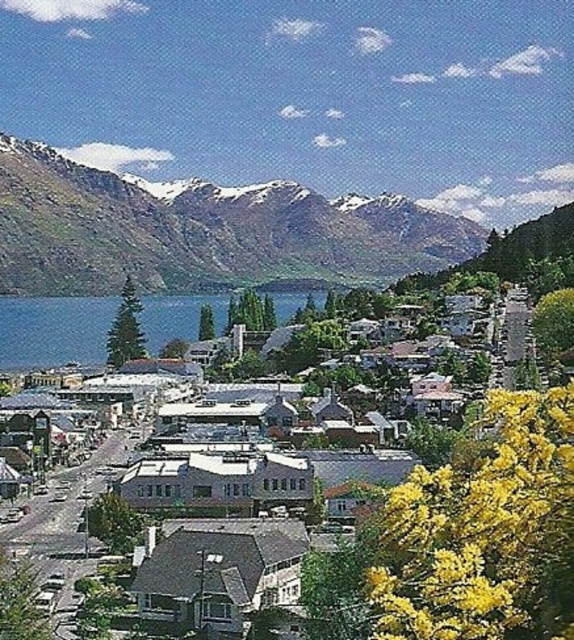
Between snowy rocky mountain at upper left and white matte building at center, which one has less height?

With less height is white matte building at center.

Does point (296, 244) come farther from viewer compared to point (60, 349)?

Yes, it is.

This screenshot has height=640, width=574. Find the location of `snowy rocky mountain at upper left`. snowy rocky mountain at upper left is located at coordinates (201, 230).

Between snowy rocky mountain at upper left and blue water at center, which one has less height?

Standing shorter between the two is blue water at center.

Who is more forward, (48, 260) or (37, 321)?

Positioned in front is point (37, 321).

The width and height of the screenshot is (574, 640). Identify the location of snowy rocky mountain at upper left. (201, 230).

Is blue water at center taller than white matte building at center?

No, blue water at center is not taller than white matte building at center.

Between blue water at center and white matte building at center, which one appears on the left side from the viewer's perspective?

blue water at center is more to the left.

The height and width of the screenshot is (640, 574). In order to click on blue water at center in this screenshot , I will do `click(53, 330)`.

At what (x,y) coordinates should I click in order to perform the action: click on blue water at center. Please return your answer as a coordinate pair (x, y). This screenshot has width=574, height=640. Looking at the image, I should click on (53, 330).